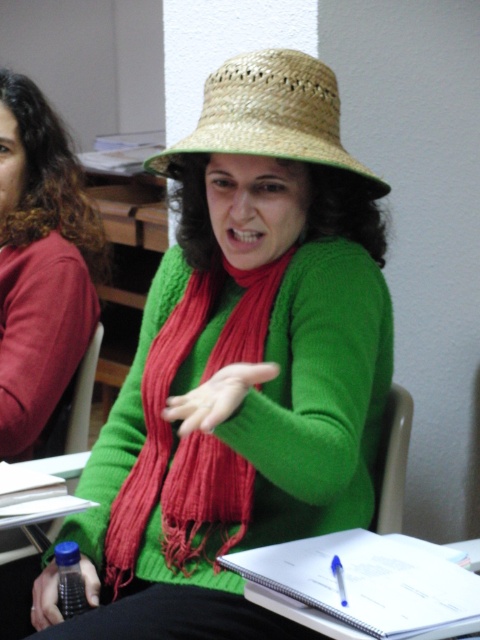
Question: Where is matte straw hat at center located in relation to transparent plastic bottle at lower left in the image?

Choices:
 (A) right
 (B) left

Answer: (A)

Question: Which object is farther from the camera taking this photo?

Choices:
 (A) transparent plastic bottle at lower left
 (B) black matte bottle at lower left
 (C) matte green sweater at center
 (D) smooth green hand at center

Answer: (C)

Question: Can you confirm if matte plastic chair at lower right is positioned to the right of transparent plastic bottle at lower left?

Choices:
 (A) no
 (B) yes

Answer: (B)

Question: Which is farther from the red knitted scarf at center?

Choices:
 (A) transparent plastic bottle at lower left
 (B) natural straw hat at center
 (C) black matte bottle at lower left
 (D) matte straw hat at center

Answer: (B)

Question: Which point appears closest to the camera in this image?

Choices:
 (A) (165, 328)
 (B) (267, 148)
 (C) (43, 627)
 (D) (409, 429)

Answer: (B)

Question: From the image, what is the correct spatial relationship of matte straw hat at center in relation to red knitted scarf at center?

Choices:
 (A) below
 (B) above

Answer: (B)